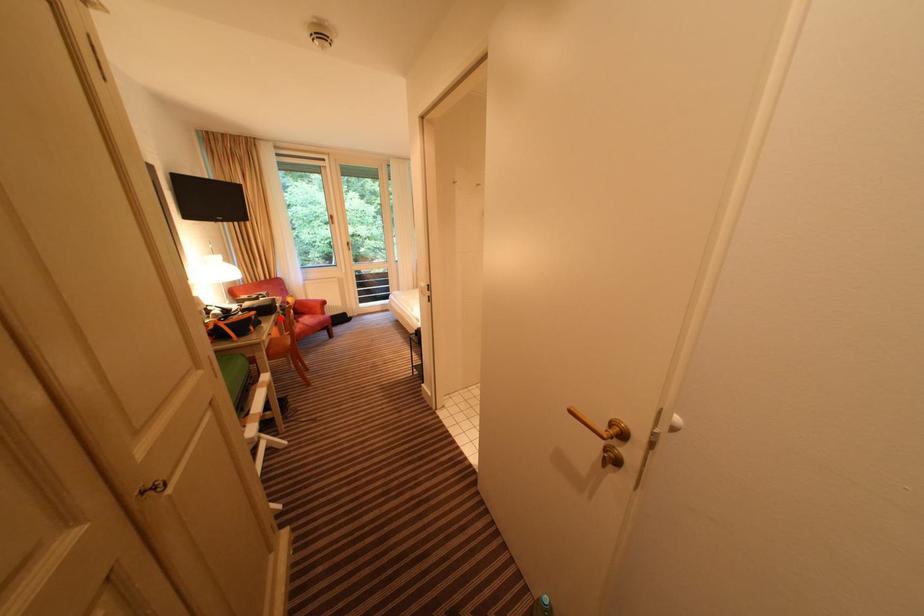
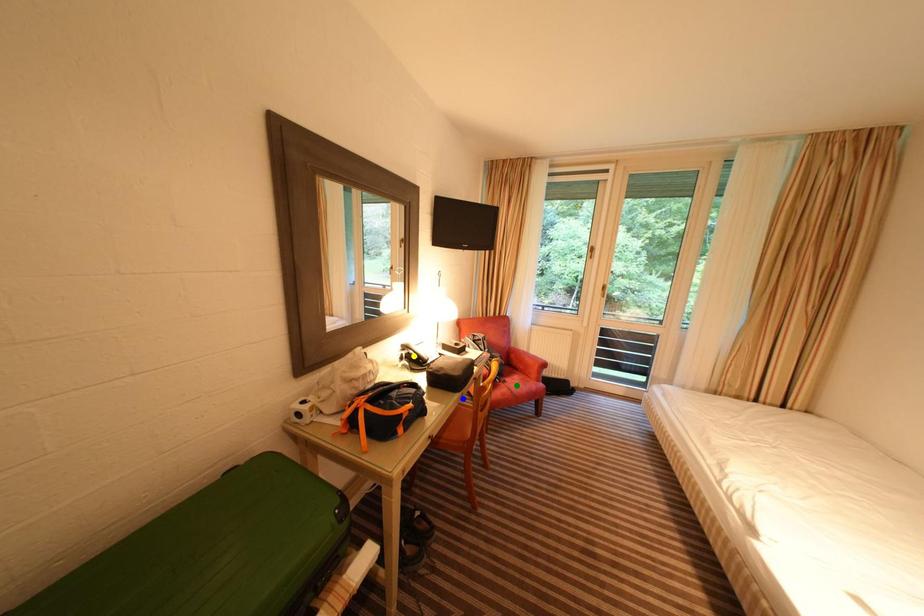
Question: I am providing you with two images of the same scene from different viewpoints. A red point is marked on the first image. You are given multiple points on the second image. Can you choose the point in image 2 that corresponds to the point in image 1?

Choices:
 (A) green point
 (B) yellow point
 (C) blue point

Answer: (C)